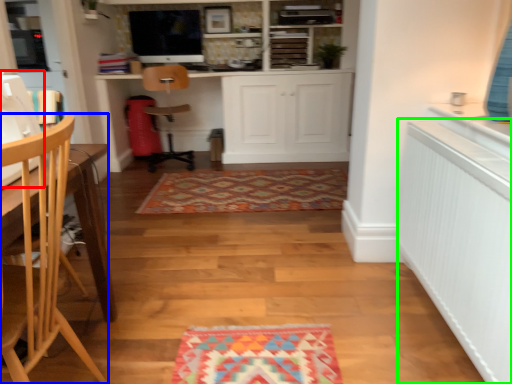
Question: Considering the real-world distances, which object is closest to sewing machine (highlighted by a red box)? chair (highlighted by a blue box) or radiator (highlighted by a green box).

Choices:
 (A) chair
 (B) radiator

Answer: (A)